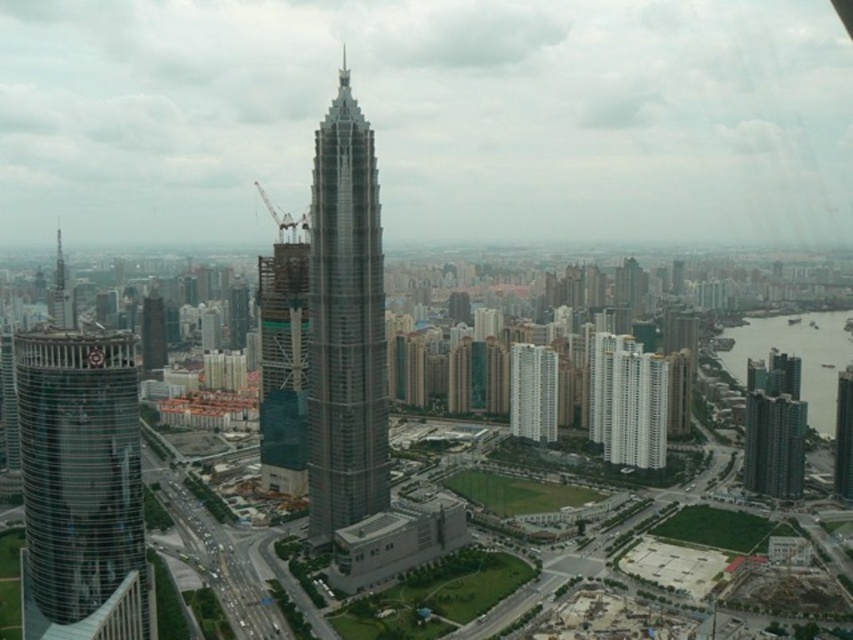
Based on the scene description, what are the coordinates of the shiny glass skyscraper at center?

The coordinates of the shiny glass skyscraper at center are at point (345,324).

You are a drone operator tasked with flying a drone between the shiny glass skyscraper at center and the glassy reflective skyscraper at center. The drone has a safety requirement that it must maintain a minimum distance of 150 meters between any two structures. Can you safely fly the drone between these two skyscrapers?

The shiny glass skyscraper at center is 171.81 meters away from the glassy reflective skyscraper at center. Since the required minimum distance is 150 meters, the drone can safely fly between them as the distance exceeds the safety requirement.